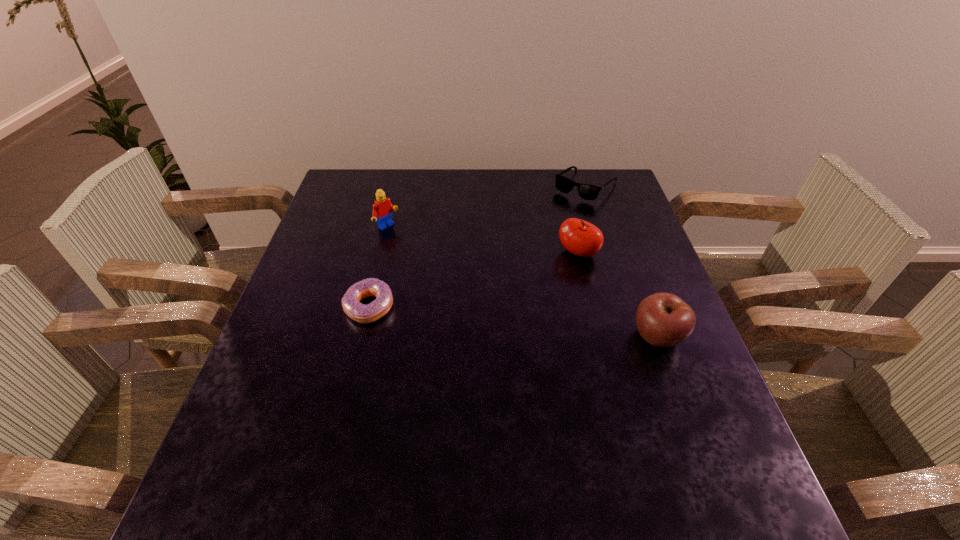
Find the location of a particular element. doughnut is located at coordinates (359, 312).

Identify the location of the right apple. click(663, 319).

Find the location of a particular element. the third shortest object is located at coordinates (663, 319).

At what (x,y) coordinates should I click in order to perform the action: click on the third nearest object. Please return your answer as a coordinate pair (x, y). Looking at the image, I should click on (581, 238).

You are a GUI agent. You are given a task and a screenshot of the screen. Output one action in this format:
    pyautogui.click(x=<x>, y=<y>)
    Task: Click on the left apple
    
    Given the screenshot: What is the action you would take?
    pyautogui.click(x=581, y=238)

This screenshot has width=960, height=540. I want to click on the fourth nearest object, so click(x=382, y=208).

The image size is (960, 540). Identify the location of the farthest object. [586, 191].

This screenshot has height=540, width=960. Find the location of `free space located on the left of the doughnut`. free space located on the left of the doughnut is located at coordinates (320, 307).

At what (x,y) coordinates should I click in order to perform the action: click on vacant area located 0.090m on the side of the third shortest object with the unique marking. Please return your answer as a coordinate pair (x, y). Image resolution: width=960 pixels, height=540 pixels. Looking at the image, I should click on (680, 396).

The width and height of the screenshot is (960, 540). Find the location of `vacant space located on the stem of the third farthest object`. vacant space located on the stem of the third farthest object is located at coordinates (501, 309).